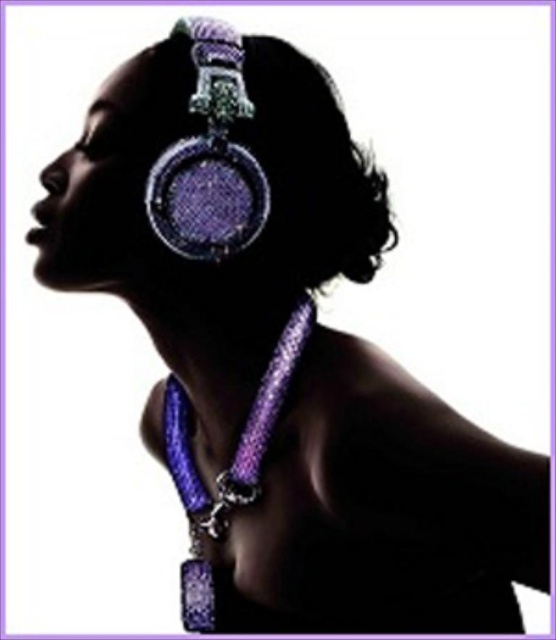
Does sparkly purple earring at upper center have a greater width compared to purple shiny necklace at center?

No, sparkly purple earring at upper center is not wider than purple shiny necklace at center.

Consider the image. Is sparkly purple earring at upper center smaller than purple shiny necklace at center?

Indeed, sparkly purple earring at upper center has a smaller size compared to purple shiny necklace at center.

Who is more forward, [240,64] or [212,323]?

Point [240,64] is more forward.

The width and height of the screenshot is (556, 640). I want to click on sparkly purple earring at upper center, so click(x=210, y=157).

Is purple mesh necklace at center to the left of purple shiny necklace at center from the viewer's perspective?

Incorrect, purple mesh necklace at center is not on the left side of purple shiny necklace at center.

Which is behind, point (191, 502) or point (222, 346)?

Positioned behind is point (191, 502).

The image size is (556, 640). I want to click on purple mesh necklace at center, so click(227, 467).

Describe the element at coordinates (201, 170) in the screenshot. This screenshot has height=640, width=556. I see `shiny purple hair at upper center` at that location.

Between shiny purple hair at upper center and sparkly purple earring at upper center, which one is positioned higher?

sparkly purple earring at upper center

Between point (130, 189) and point (178, 253), which one is positioned in front?

Point (130, 189)

I want to click on shiny purple hair at upper center, so click(x=201, y=170).